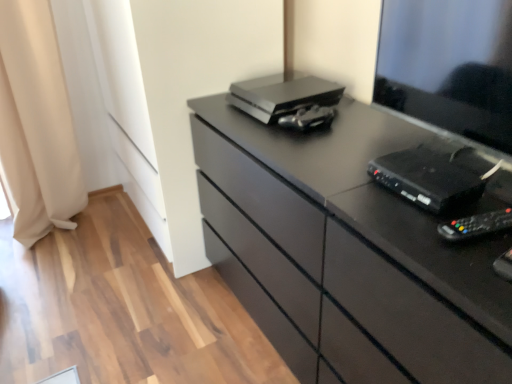
Question: Is metallic silver game controller at center, which is counted as the 3th equipment, starting from the bottom, inside matte black chest of drawers at center?

Choices:
 (A) no
 (B) yes

Answer: (B)

Question: Is matte black chest of drawers at center further to the viewer compared to metallic silver game controller at center, which ranks as the first equipment in back-to-front order?

Choices:
 (A) yes
 (B) no

Answer: (B)

Question: Does matte black chest of drawers at center have a larger size compared to metallic silver game controller at center, which is counted as the 3th equipment, starting from the bottom?

Choices:
 (A) no
 (B) yes

Answer: (B)

Question: Is matte black chest of drawers at center at the right side of metallic silver game controller at center, placed as the first equipment when sorted from top to bottom?

Choices:
 (A) yes
 (B) no

Answer: (A)

Question: Is matte black chest of drawers at center beside metallic silver game controller at center, which is the 3th equipment in front-to-back order?

Choices:
 (A) yes
 (B) no

Answer: (B)

Question: Considering the positions of satin silver printer at upper center and metallic silver game controller at center, placed as the first equipment when sorted from top to bottom, in the image, is satin silver printer at upper center bigger or smaller than metallic silver game controller at center, placed as the first equipment when sorted from top to bottom,?

Choices:
 (A) big
 (B) small

Answer: (A)

Question: Considering the positions of point (266, 117) and point (296, 127), is point (266, 117) closer or farther from the camera than point (296, 127)?

Choices:
 (A) farther
 (B) closer

Answer: (A)

Question: Do you think satin silver printer at upper center is within metallic silver game controller at center, which is counted as the 3th equipment, starting from the bottom, or outside of it?

Choices:
 (A) outside
 (B) inside

Answer: (A)

Question: Is satin silver printer at upper center taller or shorter than metallic silver game controller at center, which ranks as the first equipment in back-to-front order?

Choices:
 (A) short
 (B) tall

Answer: (B)

Question: Is beige fabric curtain at left to the left or to the right of black plastic desktop at right in the image?

Choices:
 (A) right
 (B) left

Answer: (B)

Question: From the image's perspective, is beige fabric curtain at left above or below black plastic desktop at right?

Choices:
 (A) above
 (B) below

Answer: (A)

Question: In the image, is beige fabric curtain at left positioned in front of or behind black plastic desktop at right?

Choices:
 (A) behind
 (B) front

Answer: (A)

Question: Would you say beige fabric curtain at left is inside or outside black plastic desktop at right?

Choices:
 (A) outside
 (B) inside

Answer: (A)

Question: From the image's perspective, is matte black chest of drawers at center positioned above or below black plastic device at right, which ranks as the 2th equipment in front-to-back order?

Choices:
 (A) above
 (B) below

Answer: (B)

Question: Is point (416, 334) positioned closer to the camera than point (395, 192)?

Choices:
 (A) farther
 (B) closer

Answer: (B)